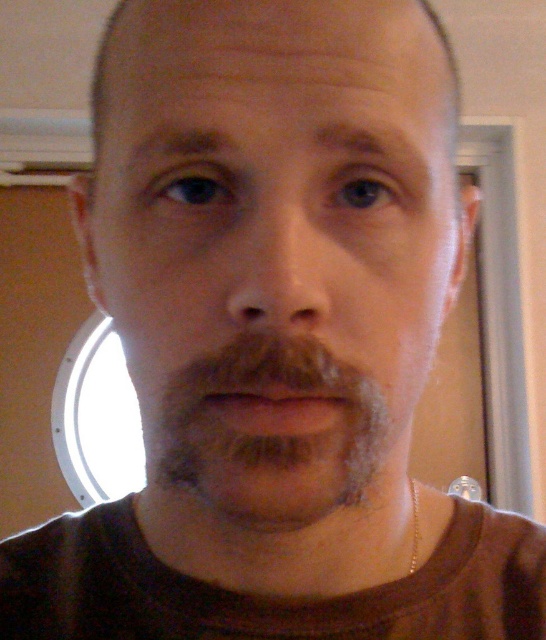
Who is shorter, smooth skin face at center or brown matte lips at center?

brown matte lips at center

Is point (205, 502) positioned behind point (204, 412)?

Yes, point (205, 502) is behind point (204, 412).

Is point (406, 449) positioned in front of point (241, 413)?

No.

I want to click on smooth skin face at center, so click(x=275, y=234).

Who is positioned more to the left, smooth skin face at center or gray fuzzy beard at center?

smooth skin face at center is more to the left.

What do you see at coordinates (275, 234) in the screenshot? The height and width of the screenshot is (640, 546). I see `smooth skin face at center` at bounding box center [275, 234].

The height and width of the screenshot is (640, 546). I want to click on smooth skin face at center, so click(x=275, y=234).

Is gray fuzzy beard at center to the right of brown matte lips at center from the viewer's perspective?

No, gray fuzzy beard at center is not to the right of brown matte lips at center.

This screenshot has width=546, height=640. What do you see at coordinates (270, 432) in the screenshot?
I see `gray fuzzy beard at center` at bounding box center [270, 432].

Find the location of a particular element. The image size is (546, 640). gray fuzzy beard at center is located at coordinates (270, 432).